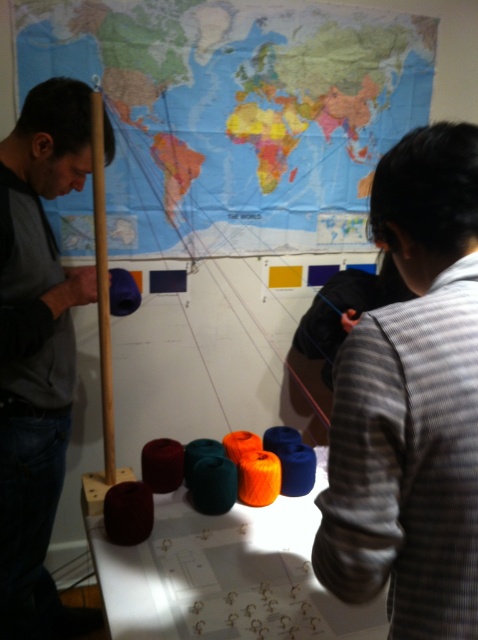
Can you confirm if matte gray sweater at left is smaller than matte blue yarn at center?

No, matte gray sweater at left is not smaller than matte blue yarn at center.

Does matte gray sweater at left appear on the left side of matte blue yarn at center?

Yes, matte gray sweater at left is to the left of matte blue yarn at center.

In order to click on matte gray sweater at left in this screenshot , I will do `click(37, 352)`.

Locate an element on the screen. matte gray sweater at left is located at coordinates (37, 352).

Between map at upper center and striped fabric at upper right, which one has less height?

striped fabric at upper right

Between map at upper center and striped fabric at upper right, which one appears on the right side from the viewer's perspective?

From the viewer's perspective, striped fabric at upper right appears more on the right side.

Who is more forward, (434, 36) or (447, 572)?

Point (447, 572) is in front.

This screenshot has width=478, height=640. I want to click on map at upper center, so click(237, 113).

Which is more to the right, striped fabric at upper right or matte blue yarn at center?

striped fabric at upper right

Which is below, striped fabric at upper right or matte blue yarn at center?

striped fabric at upper right

Identify the location of striped fabric at upper right. (412, 403).